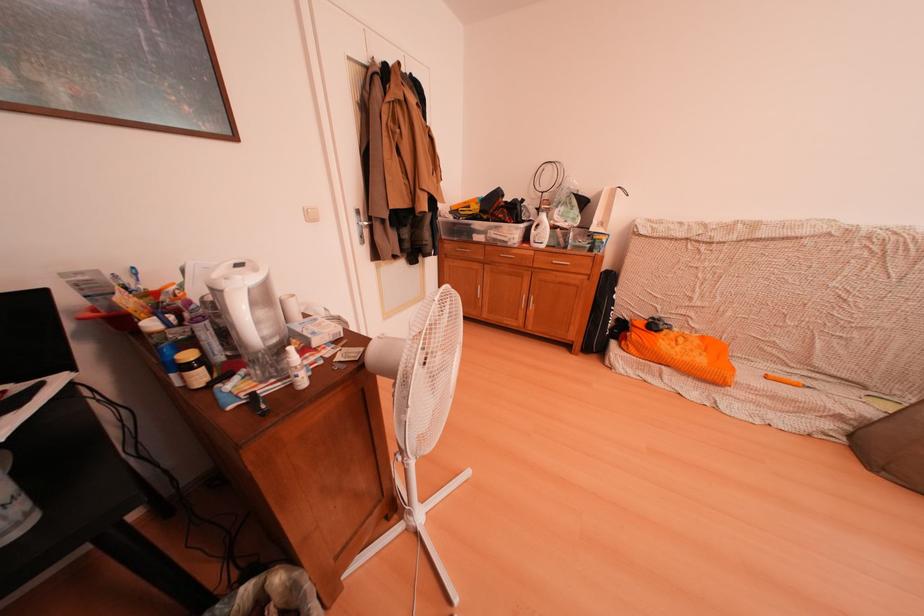
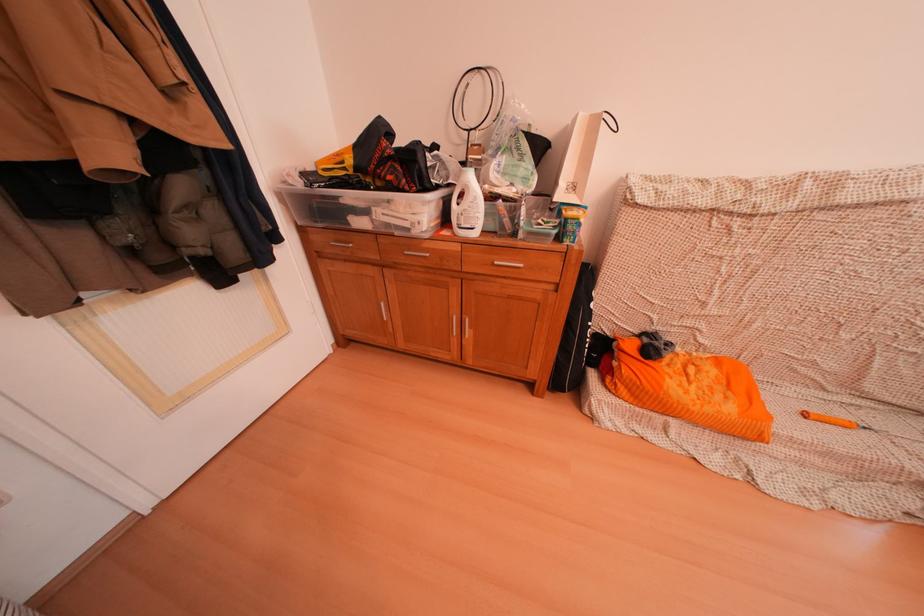
Where in the second image is the point corresponding to (536,227) from the first image?

(450, 192)